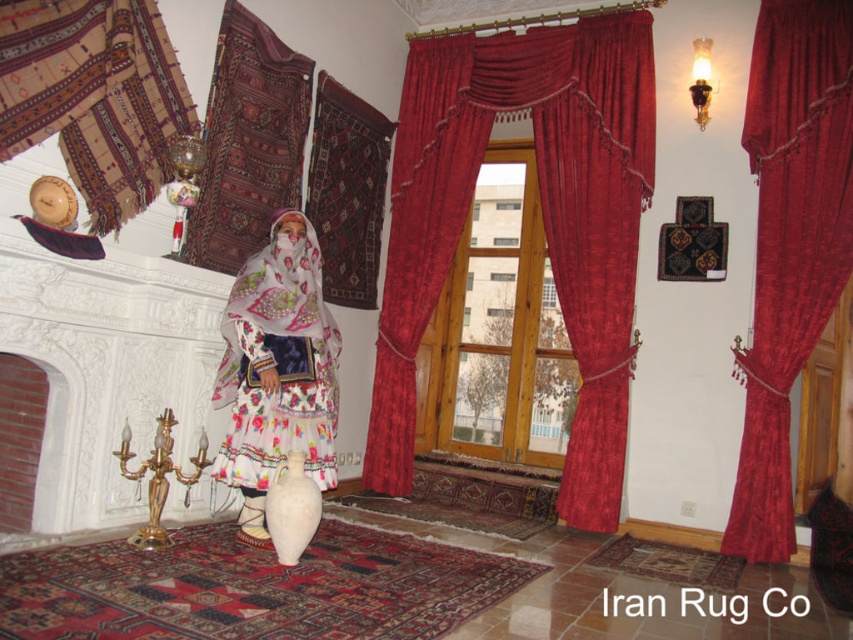
Who is more distant from viewer, [646,93] or [322,308]?

The point [646,93] is more distant.

Is point (604, 381) closer to camera compared to point (270, 410)?

No, it is not.

The width and height of the screenshot is (853, 640). What are the coordinates of `velvet curtains at center` in the screenshot? It's located at (543, 218).

Describe the element at coordinates (790, 244) in the screenshot. This screenshot has width=853, height=640. I see `velvet red curtain at right` at that location.

Find the location of a particular element. This screenshot has width=853, height=640. velvet red curtain at right is located at coordinates (790, 244).

This screenshot has height=640, width=853. I want to click on velvet curtains at center, so click(x=543, y=218).

Based on the photo, between velvet curtains at center and textured woolen rug at upper left, which one is positioned lower?

velvet curtains at center

Describe the element at coordinates (543, 218) in the screenshot. I see `velvet curtains at center` at that location.

Find the location of a particular element. The image size is (853, 640). velvet curtains at center is located at coordinates (543, 218).